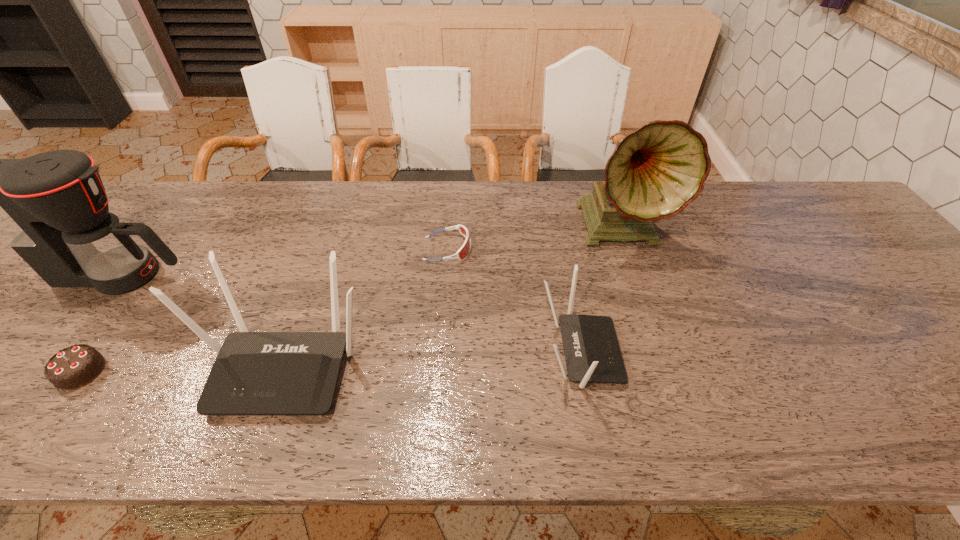
At what (x,y) coordinates should I click in order to perform the action: click on free location located pour from the carafe of the coffee maker. Please return your answer as a coordinate pair (x, y). Looking at the image, I should click on (312, 275).

This screenshot has width=960, height=540. Identify the location of free space located 0.160m from the horn of the record player. (650, 310).

The width and height of the screenshot is (960, 540). What are the coordinates of `vacant point located on the front-facing side of the goggles` in the screenshot? It's located at (508, 249).

You are a GUI agent. You are given a task and a screenshot of the screen. Output one action in this format:
    pyautogui.click(x=<x>, y=<y>)
    Task: Click on the free space located on the right of the fifth tallest object
    This screenshot has height=540, width=960.
    Given the screenshot: What is the action you would take?
    pyautogui.click(x=192, y=372)

The image size is (960, 540). Identify the location of object at the far edge. (655, 172).

The image size is (960, 540). I want to click on chocolate cake that is positioned at the near edge, so click(x=73, y=367).

In order to click on object situated at the left edge in this screenshot , I will do `click(51, 208)`.

Where is `vacant space at the far edge of the desktop`? The height and width of the screenshot is (540, 960). vacant space at the far edge of the desktop is located at coordinates (536, 188).

Locate an element on the screen. The image size is (960, 540). free point at the near edge is located at coordinates (538, 366).

This screenshot has width=960, height=540. Find the location of `vacant area at the right edge of the desktop`. vacant area at the right edge of the desktop is located at coordinates (859, 283).